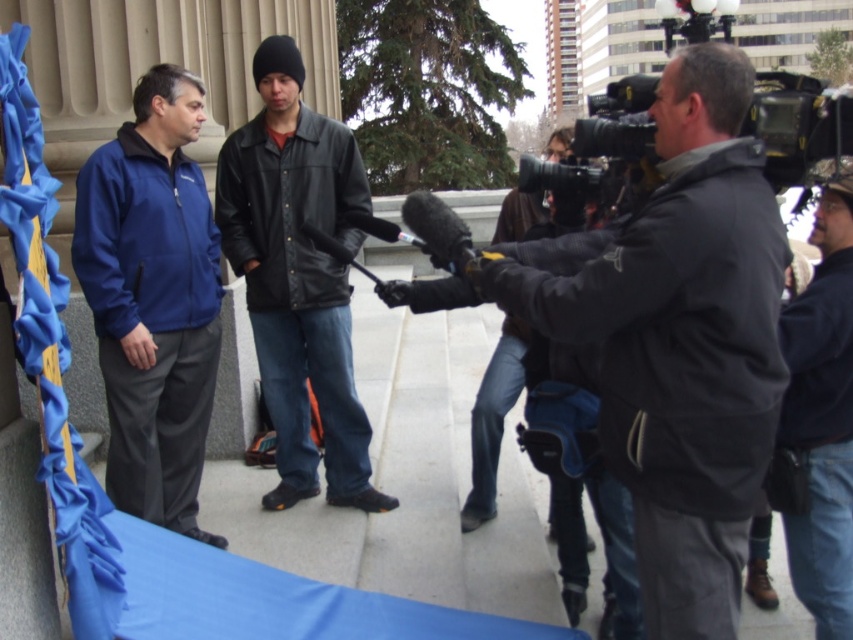
Question: Which of the following is the farthest from the observer?

Choices:
 (A) (706, 259)
 (B) (521, 205)
 (C) (833, 333)
 (D) (260, 353)

Answer: (B)

Question: Is leather jacket at center bigger than denim jacket at center?

Choices:
 (A) yes
 (B) no

Answer: (A)

Question: Can you confirm if dark gray jacket at center is positioned above matte blue jacket at left?

Choices:
 (A) no
 (B) yes

Answer: (A)

Question: Which object is farther from the camera taking this photo?

Choices:
 (A) matte blue jacket at left
 (B) dark gray jacket at center
 (C) leather jacket at center

Answer: (C)

Question: Can you confirm if dark gray jacket at center is positioned above dark gray jacket at right?

Choices:
 (A) yes
 (B) no

Answer: (A)

Question: Which object appears farthest from the camera in this image?

Choices:
 (A) dark gray jacket at center
 (B) leather jacket at center
 (C) dark gray jacket at right
 (D) denim jacket at center

Answer: (B)